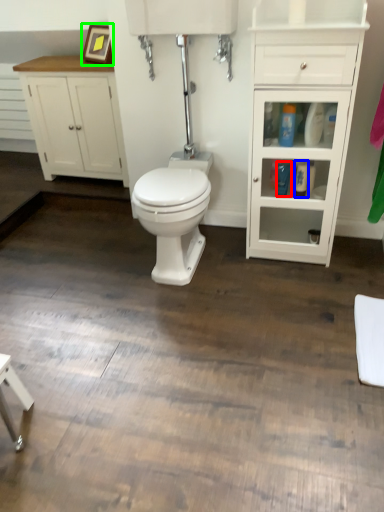
Question: Which object is the closest to the toiletry (highlighted by a red box)? Choose among these: toiletry (highlighted by a blue box) or picture frame (highlighted by a green box).

Choices:
 (A) toiletry
 (B) picture frame

Answer: (A)